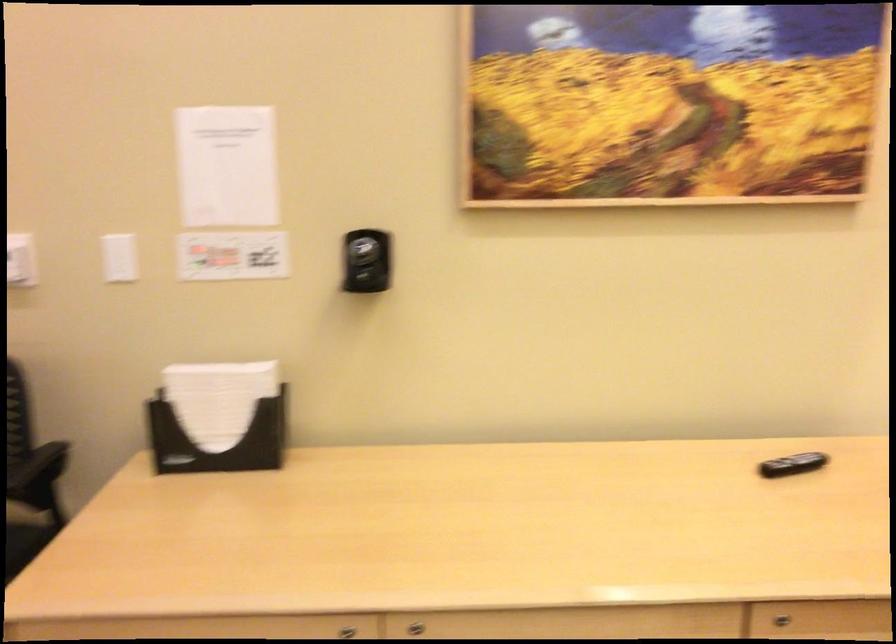
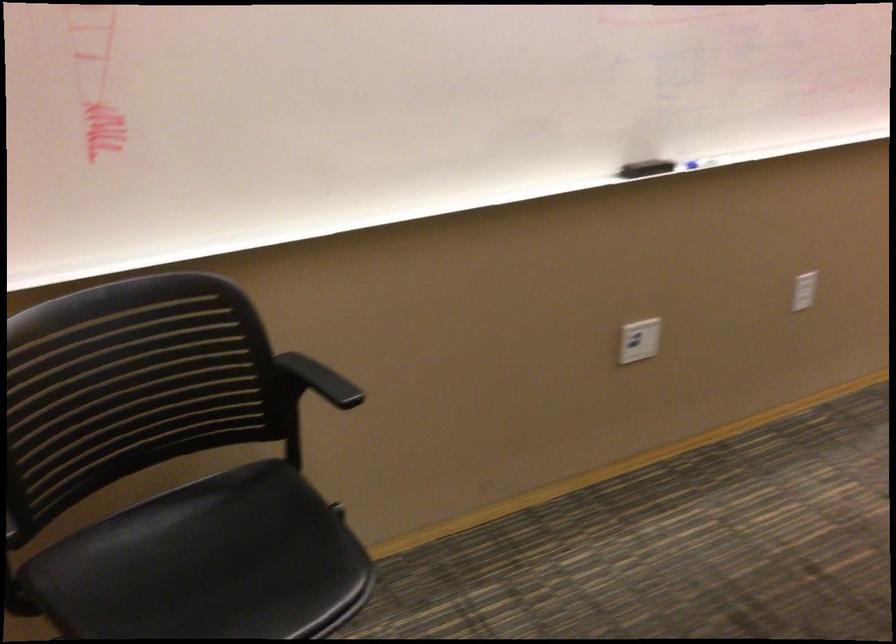
First-person continuous shooting, in which direction is the camera rotating?

The camera's rotation is toward right-down.